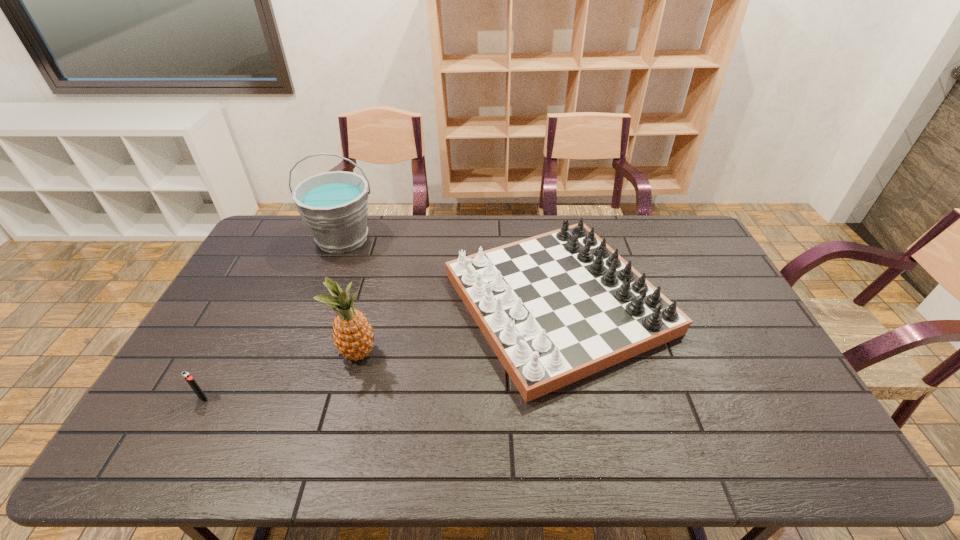
Where is `empty space between the bucket and the igniter`? empty space between the bucket and the igniter is located at coordinates (273, 318).

The height and width of the screenshot is (540, 960). Identify the location of vacant area that lies between the igniter and the bucket. (273, 318).

At what (x,y) coordinates should I click in order to perform the action: click on free space between the shortest object and the third shortest object. Please return your answer as a coordinate pair (x, y). Looking at the image, I should click on (281, 376).

This screenshot has width=960, height=540. Find the location of `the third closest object to the leftmost object`. the third closest object to the leftmost object is located at coordinates (557, 307).

Locate which object is the second closest to the shortest object. Please provide its 2D coordinates. Your answer should be formatted as a tuple, i.e. [(x, y)], where the tuple contains the x and y coordinates of a point satisfying the conditions above.

[(334, 205)]

Identify the location of free space that satisfies the following two spatial constraints: 1. on the back side of the pineapple; 2. on the left side of the leftmost object. (228, 353).

Identify the location of vacant position in the image that satisfies the following two spatial constraints: 1. on the front side of the pineapple; 2. on the right side of the bucket. This screenshot has width=960, height=540. (299, 353).

You are a GUI agent. You are given a task and a screenshot of the screen. Output one action in this format:
    pyautogui.click(x=<x>, y=<y>)
    Task: Click on the vacant space that satisfies the following two spatial constraints: 1. on the back side of the second shortest object; 2. on the right side of the igniter
    The width and height of the screenshot is (960, 540).
    Given the screenshot: What is the action you would take?
    pyautogui.click(x=254, y=303)

Find the location of a particular element. The width and height of the screenshot is (960, 540). blank area in the image that satisfies the following two spatial constraints: 1. on the back side of the third shortest object; 2. on the right side of the igniter is located at coordinates (228, 353).